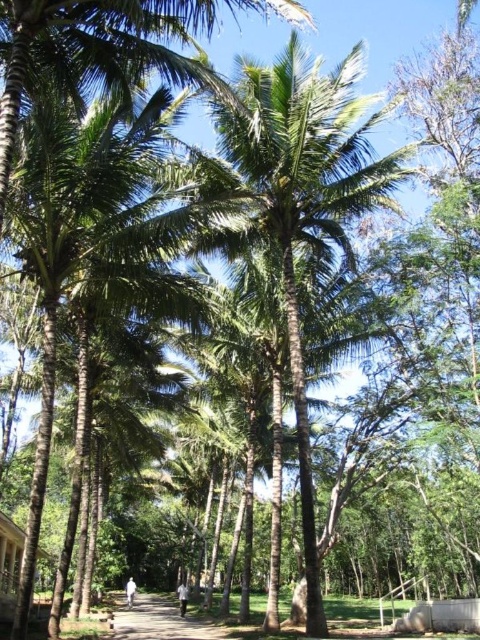
You are standing at the entrance of the pathway and want to reach the green leafy coconut tree at center. According to the coordinates provided, in which direction should you walk to reach it?

The green leafy coconut tree at center is located at coordinates point (295, 202), so you should walk forward along the pathway towards the center to reach it.

You are standing at the wooden hut at lower left and want to walk to the brown dirt path at center. Which direction should you move to reach the path?

Since the brown dirt path at center has a greater height compared to the wooden hut at lower left, you should move upward to reach the path.